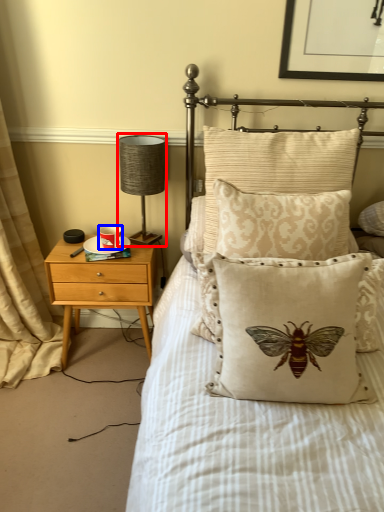
Question: Which of the following is the closest to the observer, table lamp (highlighted by a red box) or coffee cup (highlighted by a blue box)?

Choices:
 (A) table lamp
 (B) coffee cup

Answer: (A)